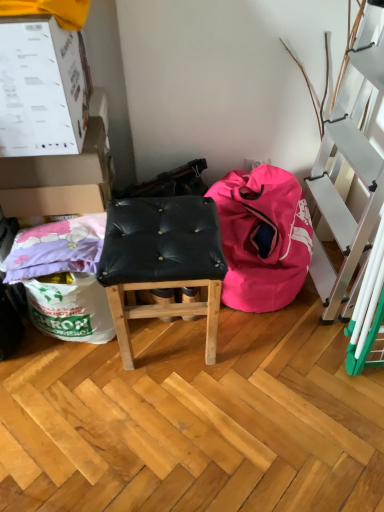
Question: Is black leather stool at center surrounding white cardboard box at upper left, the 2th box when ordered from back to front?

Choices:
 (A) no
 (B) yes

Answer: (A)

Question: Is black leather stool at center turned away from white cardboard box at upper left, the 2th box when ordered from back to front?

Choices:
 (A) no
 (B) yes

Answer: (A)

Question: Does black leather stool at center lie behind white cardboard box at upper left, the 2th box when ordered from back to front?

Choices:
 (A) yes
 (B) no

Answer: (A)

Question: Considering the relative sizes of black leather stool at center and white cardboard box at upper left, placed as the first box when sorted from front to back, in the image provided, is black leather stool at center thinner than white cardboard box at upper left, placed as the first box when sorted from front to back,?

Choices:
 (A) no
 (B) yes

Answer: (A)

Question: Are black leather stool at center and white cardboard box at upper left, the 2th box when ordered from back to front, making contact?

Choices:
 (A) no
 (B) yes

Answer: (A)

Question: Are black leather stool at center and white cardboard box at upper left, the 2th box when ordered from back to front, located far from each other?

Choices:
 (A) yes
 (B) no

Answer: (B)

Question: Are black leather stool at center and pink fabric bean bag at lower right making contact?

Choices:
 (A) yes
 (B) no

Answer: (B)

Question: Is black leather stool at center at the left side of pink fabric bean bag at lower right?

Choices:
 (A) yes
 (B) no

Answer: (A)

Question: From the image's perspective, does black leather stool at center appear lower than pink fabric bean bag at lower right?

Choices:
 (A) no
 (B) yes

Answer: (B)

Question: Considering the relative sizes of black leather stool at center and pink fabric bean bag at lower right in the image provided, is black leather stool at center bigger than pink fabric bean bag at lower right?

Choices:
 (A) yes
 (B) no

Answer: (B)

Question: From a real-world perspective, does black leather stool at center sit lower than pink fabric bean bag at lower right?

Choices:
 (A) yes
 (B) no

Answer: (B)

Question: Does black leather stool at center have a greater height compared to pink fabric bean bag at lower right?

Choices:
 (A) yes
 (B) no

Answer: (A)

Question: Considering the relative sizes of white cardboard box at upper left, placed as the first box when sorted from front to back, and white cardboard box at upper left, the 1th box from the back, in the image provided, is white cardboard box at upper left, placed as the first box when sorted from front to back, thinner than white cardboard box at upper left, the 1th box from the back,?

Choices:
 (A) yes
 (B) no

Answer: (B)